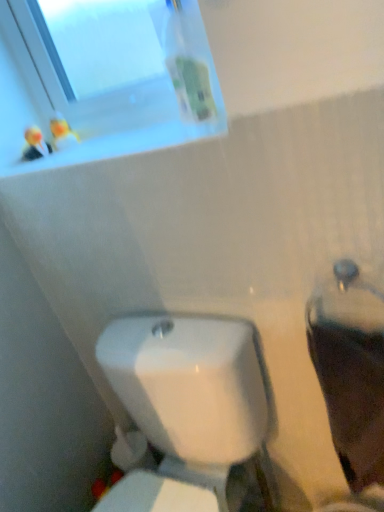
Question: Is transparent glass window at upper left taller than matte white toilet at right?

Choices:
 (A) no
 (B) yes

Answer: (A)

Question: From the image's perspective, would you say transparent glass window at upper left is shown under matte white toilet at right?

Choices:
 (A) yes
 (B) no

Answer: (B)

Question: Is transparent glass window at upper left turned away from matte white toilet at right?

Choices:
 (A) no
 (B) yes

Answer: (A)

Question: Is matte white toilet at right inside transparent glass window at upper left?

Choices:
 (A) no
 (B) yes

Answer: (A)

Question: Does transparent glass window at upper left have a larger size compared to matte white toilet at right?

Choices:
 (A) yes
 (B) no

Answer: (B)

Question: From the image's perspective, is transparent glass window at upper left on matte white toilet at right?

Choices:
 (A) yes
 (B) no

Answer: (A)

Question: From a real-world perspective, is white glossy toilet at lower center positioned over matte white toilet at right based on gravity?

Choices:
 (A) yes
 (B) no

Answer: (B)

Question: Could you tell me if white glossy toilet at lower center is facing matte white toilet at right?

Choices:
 (A) yes
 (B) no

Answer: (B)

Question: Is white glossy toilet at lower center closer to the viewer compared to matte white toilet at right?

Choices:
 (A) yes
 (B) no

Answer: (A)

Question: Is matte white toilet at right surrounded by white glossy toilet at lower center?

Choices:
 (A) yes
 (B) no

Answer: (B)

Question: Does white glossy toilet at lower center touch matte white toilet at right?

Choices:
 (A) yes
 (B) no

Answer: (B)

Question: Does white glossy toilet at lower center have a greater height compared to matte white toilet at right?

Choices:
 (A) yes
 (B) no

Answer: (A)

Question: From the image's perspective, is white glossy toilet at lower center on top of transparent glass window at upper left?

Choices:
 (A) no
 (B) yes

Answer: (A)